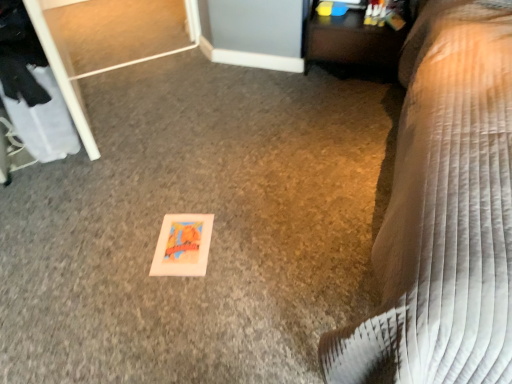
Question: Considering the relative sizes of brown quilted bedspread at lower right and wooden table at upper right in the image provided, is brown quilted bedspread at lower right smaller than wooden table at upper right?

Choices:
 (A) no
 (B) yes

Answer: (A)

Question: Is wooden table at upper right inside brown quilted bedspread at lower right?

Choices:
 (A) yes
 (B) no

Answer: (B)

Question: Is brown quilted bedspread at lower right looking in the opposite direction of wooden table at upper right?

Choices:
 (A) yes
 (B) no

Answer: (B)

Question: From a real-world perspective, is brown quilted bedspread at lower right positioned over wooden table at upper right based on gravity?

Choices:
 (A) no
 (B) yes

Answer: (B)

Question: From a real-world perspective, is brown quilted bedspread at lower right below wooden table at upper right?

Choices:
 (A) no
 (B) yes

Answer: (A)

Question: Considering the relative sizes of brown quilted bedspread at lower right and wooden table at upper right in the image provided, is brown quilted bedspread at lower right taller than wooden table at upper right?

Choices:
 (A) no
 (B) yes

Answer: (B)

Question: Considering the relative sizes of wooden table at upper right and brown quilted bedspread at lower right in the image provided, is wooden table at upper right taller than brown quilted bedspread at lower right?

Choices:
 (A) no
 (B) yes

Answer: (A)

Question: Is wooden table at upper right positioned in front of brown quilted bedspread at lower right?

Choices:
 (A) no
 (B) yes

Answer: (A)

Question: Can you confirm if wooden table at upper right is shorter than brown quilted bedspread at lower right?

Choices:
 (A) yes
 (B) no

Answer: (A)

Question: From a real-world perspective, is wooden table at upper right on brown quilted bedspread at lower right?

Choices:
 (A) yes
 (B) no

Answer: (B)

Question: Can you confirm if wooden table at upper right is thinner than brown quilted bedspread at lower right?

Choices:
 (A) yes
 (B) no

Answer: (A)

Question: Does wooden table at upper right appear on the right side of brown quilted bedspread at lower right?

Choices:
 (A) no
 (B) yes

Answer: (A)

Question: In terms of height, does brown quilted bedspread at lower right look taller or shorter compared to wooden table at upper right?

Choices:
 (A) short
 (B) tall

Answer: (B)